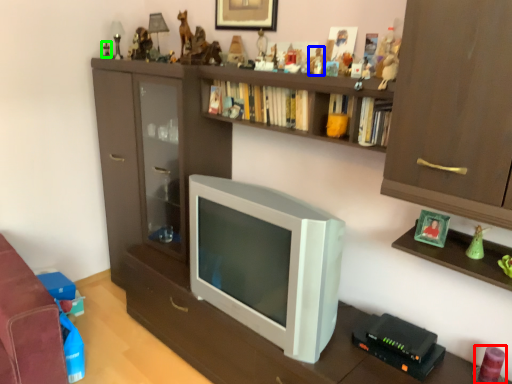
Question: Considering the real-world distances, which object is farthest from toy (highlighted by a red box)? toy (highlighted by a blue box) or toy (highlighted by a green box)?

Choices:
 (A) toy
 (B) toy

Answer: (B)